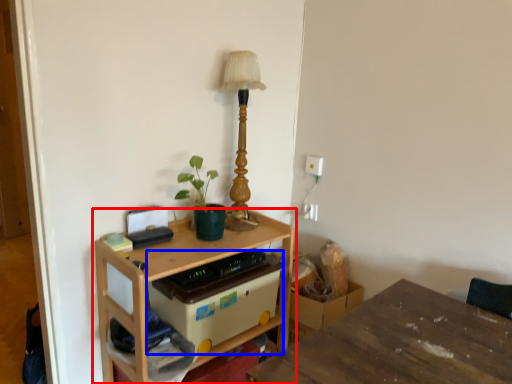
Question: Which object is further to the camera taking this photo, table (highlighted by a red box) or storage box (highlighted by a blue box)?

Choices:
 (A) table
 (B) storage box

Answer: (B)